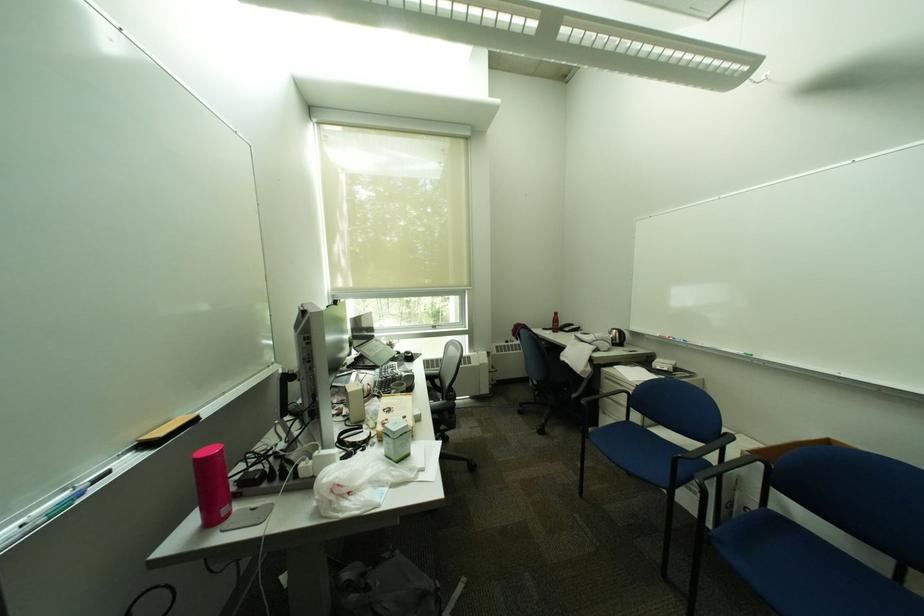
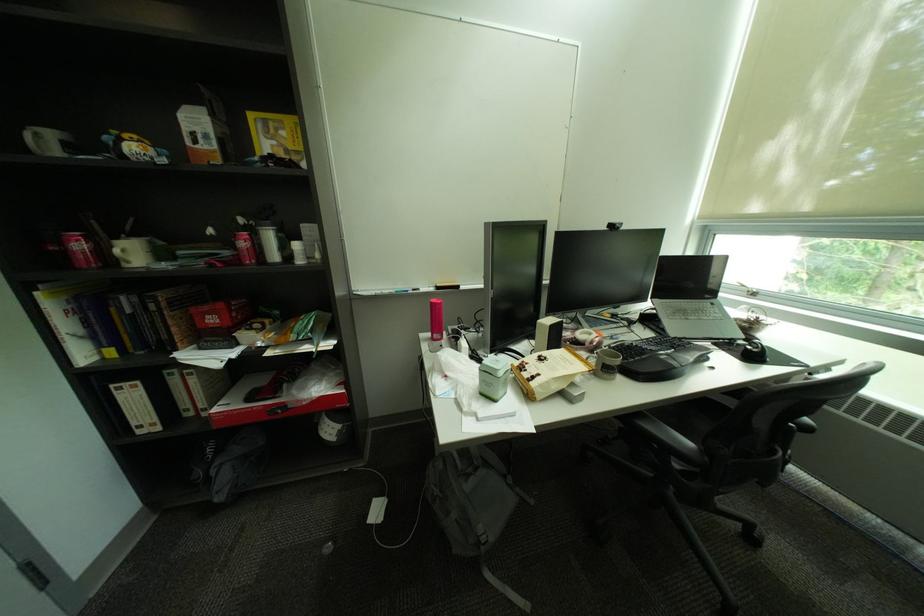
Where in the second image is the point corresponding to pixel 346 302 from the first image?

(621, 227)